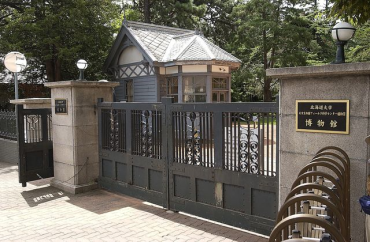
At what (x,y) coordinates should I click in order to perform the action: click on lights. Please return your answer as a coordinate pair (x, y). The width and height of the screenshot is (370, 242). Looking at the image, I should click on (339, 51).